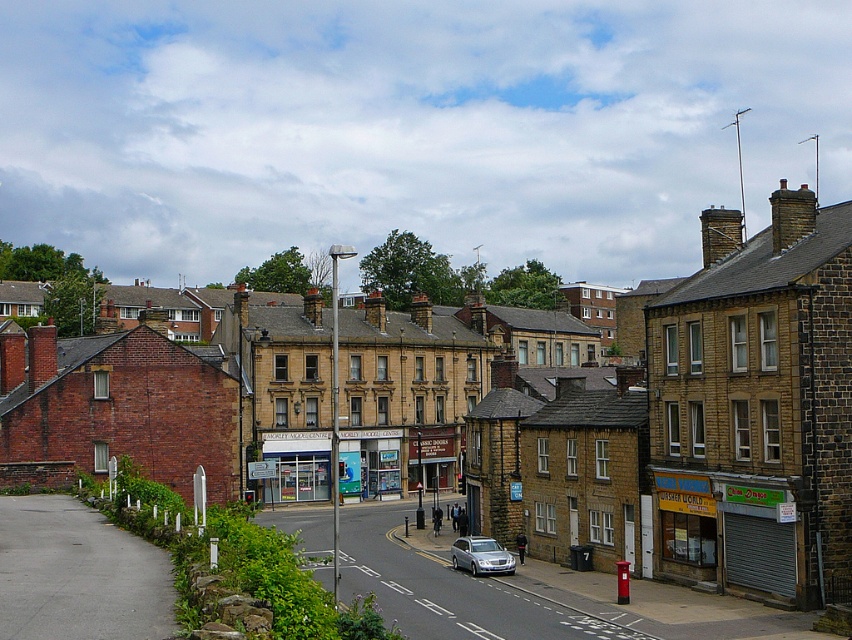
Question: Which object appears farthest from the camera in this image?

Choices:
 (A) brown brick building at center
 (B) silver metallic car at center

Answer: (B)

Question: Does brown brick building at center appear over silver metallic car at center?

Choices:
 (A) yes
 (B) no

Answer: (A)

Question: Does brown brick building at center have a greater width compared to silver metallic car at center?

Choices:
 (A) no
 (B) yes

Answer: (B)

Question: Can you confirm if brown brick building at center is positioned below silver metallic car at center?

Choices:
 (A) no
 (B) yes

Answer: (A)